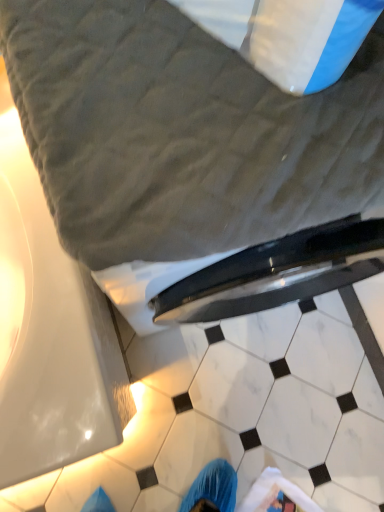
Locate an element on the screen. The height and width of the screenshot is (512, 384). blank space situated above gray quilted bed at upper center (from a real-world perspective) is located at coordinates (212, 97).